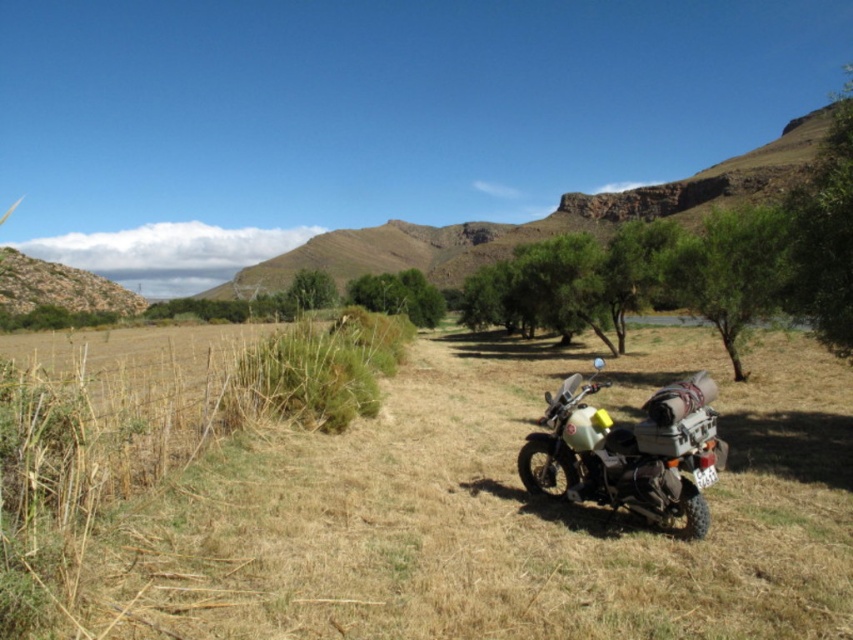
Question: Based on their relative distances, which object is nearer to the dry grass at lower center?

Choices:
 (A) green leafy tree at upper right
 (B) green leafy tree at center-right
 (C) green leafy tree at center
 (D) matte black motorbike at center

Answer: (D)

Question: Does green leafy tree at upper right come behind green leafy tree at center-right?

Choices:
 (A) no
 (B) yes

Answer: (A)

Question: Is dry grass at lower center thinner than green leafy tree at center-right?

Choices:
 (A) no
 (B) yes

Answer: (A)

Question: Which of the following is the closest to the observer?

Choices:
 (A) (686, 268)
 (B) (114, 563)
 (C) (701, 384)

Answer: (B)

Question: Estimate the real-world distances between objects in this image. Which object is closer to the green leafy tree at center?

Choices:
 (A) matte black motorbike at center
 (B) dry grass at lower center
 (C) green leafy tree at center-right
 (D) green leafy tree at upper right

Answer: (B)

Question: Does green leafy tree at upper right have a lesser width compared to green leafy tree at center-right?

Choices:
 (A) no
 (B) yes

Answer: (A)